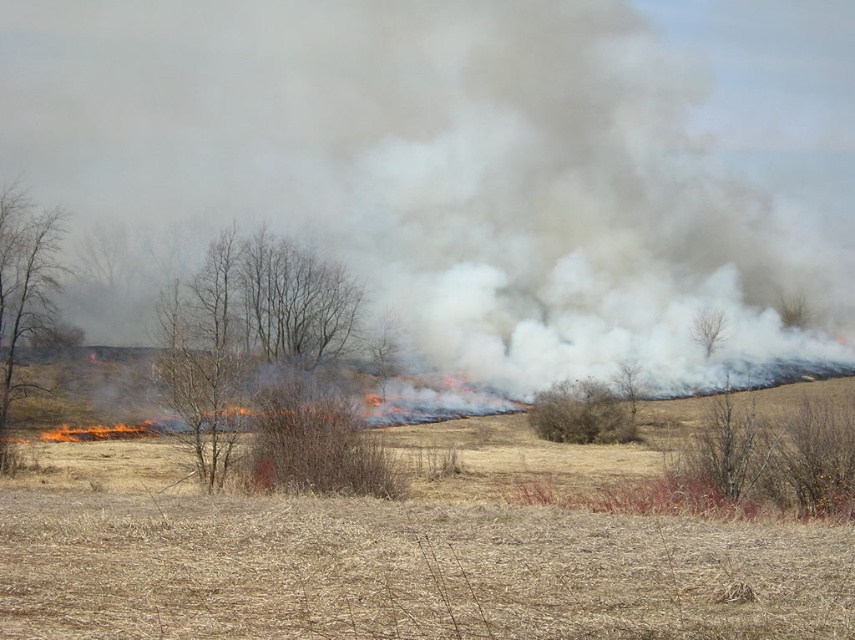
You are a firefighter trying to assess the spread of the fire in the image. You notice a brown dry bush at center. Based on its position, can you estimate how far it is from the fire source? Please provide your answer in meters.

The brown dry bush at center is located at coordinates point (581, 413). Since the fire is visible as patches of bright orange and yellow in the background, the bush is likely positioned away from the immediate fire source, but the exact distance cannot be determined without scale information.

You are a firefighter trying to assess the fire spread. You see the brown textured tree at center. Where is the tree located in the image coordinates?

The brown textured tree at center is located at coordinates point (628, 384).